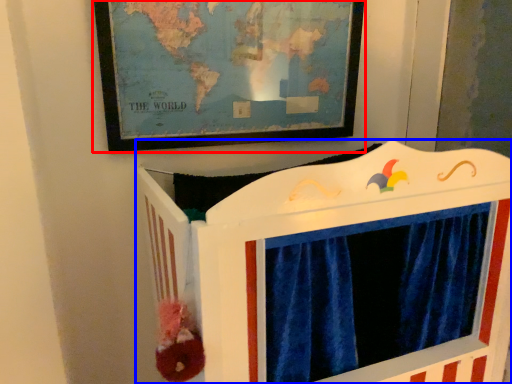
Question: Which point is further to the camera, picture frame (highlighted by a red box) or furniture (highlighted by a blue box)?

Choices:
 (A) picture frame
 (B) furniture

Answer: (A)